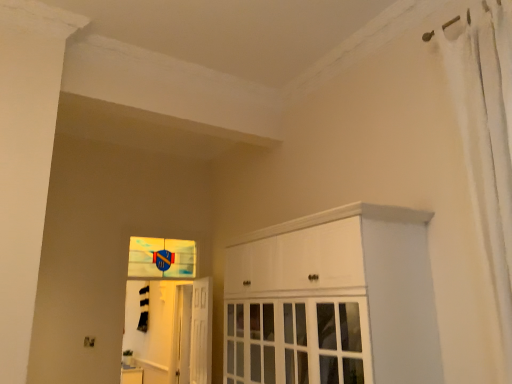
Question: Is the surface of metallic elevator at center in direct contact with translucent glass screen door at lower left?

Choices:
 (A) no
 (B) yes

Answer: (A)

Question: From the image's perspective, is metallic elevator at center located beneath translucent glass screen door at lower left?

Choices:
 (A) yes
 (B) no

Answer: (B)

Question: Is metallic elevator at center wider than translucent glass screen door at lower left?

Choices:
 (A) no
 (B) yes

Answer: (A)

Question: Is metallic elevator at center to the left of translucent glass screen door at lower left from the viewer's perspective?

Choices:
 (A) no
 (B) yes

Answer: (B)

Question: From a real-world perspective, is metallic elevator at center positioned under translucent glass screen door at lower left based on gravity?

Choices:
 (A) no
 (B) yes

Answer: (A)

Question: Is metallic elevator at center not within translucent glass screen door at lower left?

Choices:
 (A) yes
 (B) no

Answer: (A)

Question: Can you confirm if metallic elevator at center is wider than white fabric shower curtain at right?

Choices:
 (A) yes
 (B) no

Answer: (B)

Question: From a real-world perspective, is metallic elevator at center physically above white fabric shower curtain at right?

Choices:
 (A) no
 (B) yes

Answer: (A)

Question: Can you confirm if metallic elevator at center is smaller than white fabric shower curtain at right?

Choices:
 (A) yes
 (B) no

Answer: (A)

Question: Is metallic elevator at center taller than white fabric shower curtain at right?

Choices:
 (A) yes
 (B) no

Answer: (B)

Question: From the image's perspective, is metallic elevator at center under white fabric shower curtain at right?

Choices:
 (A) yes
 (B) no

Answer: (A)

Question: From a real-world perspective, does metallic elevator at center sit lower than white fabric shower curtain at right?

Choices:
 (A) no
 (B) yes

Answer: (B)

Question: Can you confirm if white glossy cabinet at center is positioned to the right of white glossy door at center?

Choices:
 (A) no
 (B) yes

Answer: (B)